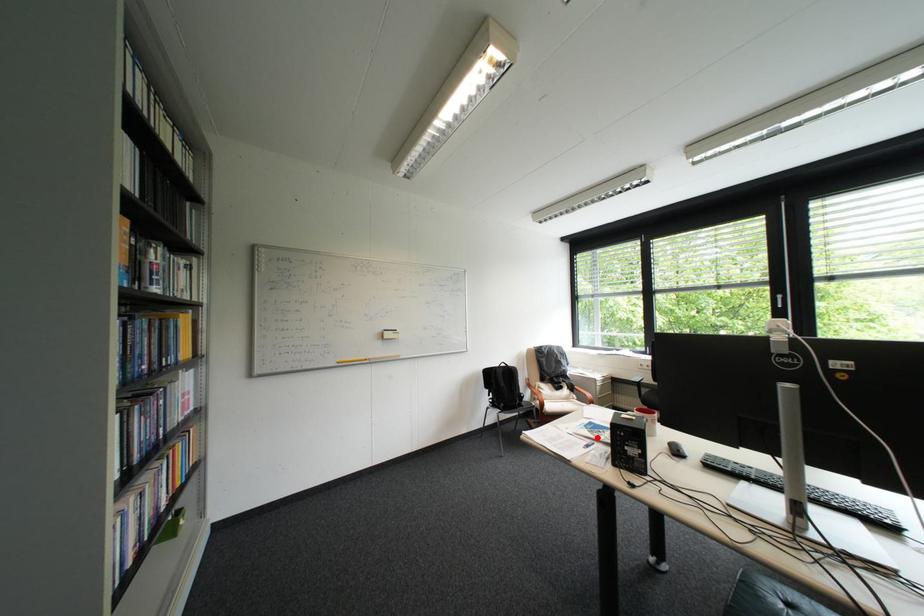
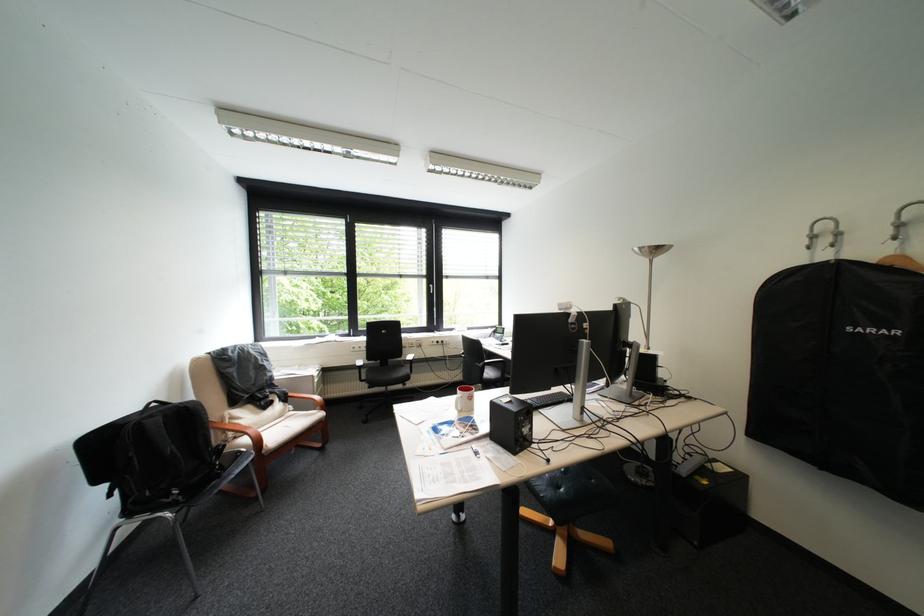
Locate, in the second image, the point that corresponds to the highlighted location in the first image.

(469, 446)